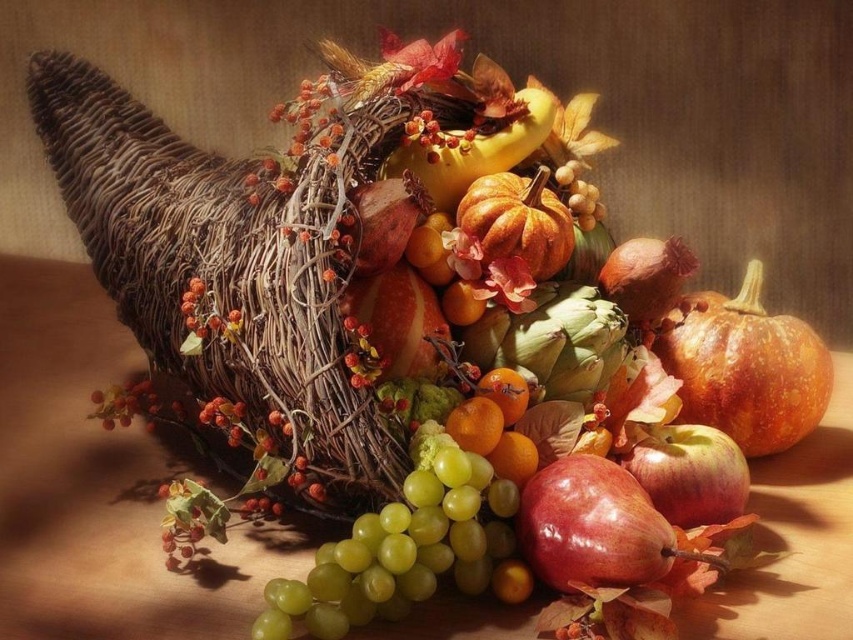
Question: Which is farther from the matte orange pumpkin at center?

Choices:
 (A) speckled orange pumpkin at center
 (B) green matte grapes at center

Answer: (B)

Question: Can you confirm if green matte grapes at center is positioned above glossy red apple at center?

Choices:
 (A) no
 (B) yes

Answer: (A)

Question: Estimate the real-world distances between objects in this image. Which object is farther from the green matte grapes at center?

Choices:
 (A) speckled orange pumpkin at center
 (B) glossy red apple at center

Answer: (A)

Question: Which object appears farthest from the camera in this image?

Choices:
 (A) matte orange pumpkin at center
 (B) glossy red apple at center
 (C) speckled orange pumpkin at center
 (D) green matte grapes at center

Answer: (C)

Question: Does green matte grapes at center appear under matte orange pumpkin at center?

Choices:
 (A) no
 (B) yes

Answer: (B)

Question: Can you confirm if green matte grapes at center is positioned above matte orange pumpkin at center?

Choices:
 (A) no
 (B) yes

Answer: (A)